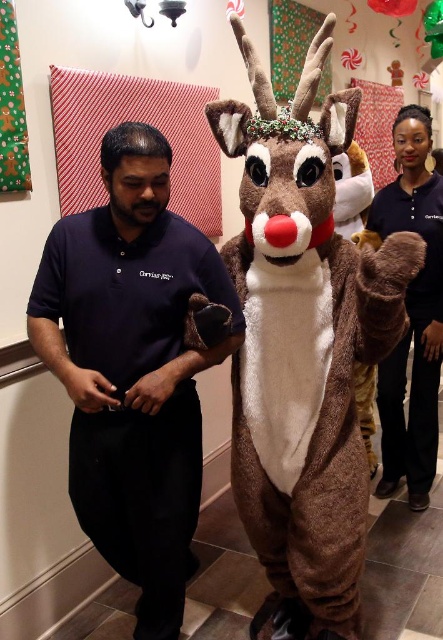
Can you confirm if fuzzy brown reindeer at center is wider than dark blue cotton shirt at center?

No.

Is fuzzy brown reindeer at center further to camera compared to dark blue cotton shirt at center?

No, it is in front of dark blue cotton shirt at center.

Between point (379, 304) and point (58, 376), which one is positioned in front?

Point (379, 304)

Locate an element on the screen. The width and height of the screenshot is (443, 640). fuzzy brown reindeer at center is located at coordinates (303, 348).

Is dark blue cotton shirt at center bigger than brown plush reindeer at center?

Yes, dark blue cotton shirt at center is bigger than brown plush reindeer at center.

Is dark blue cotton shirt at center thinner than brown plush reindeer at center?

Incorrect, dark blue cotton shirt at center's width is not less than brown plush reindeer at center's.

Identify the location of dark blue cotton shirt at center. (132, 369).

Can you confirm if fuzzy brown reindeer at center is thinner than brown plush reindeer at center?

No.

Who is positioned more to the left, fuzzy brown reindeer at center or brown plush reindeer at center?

fuzzy brown reindeer at center is more to the left.

Is point (329, 420) more distant than point (426, 156)?

That is False.

Find the location of a particular element. fuzzy brown reindeer at center is located at coordinates (303, 348).